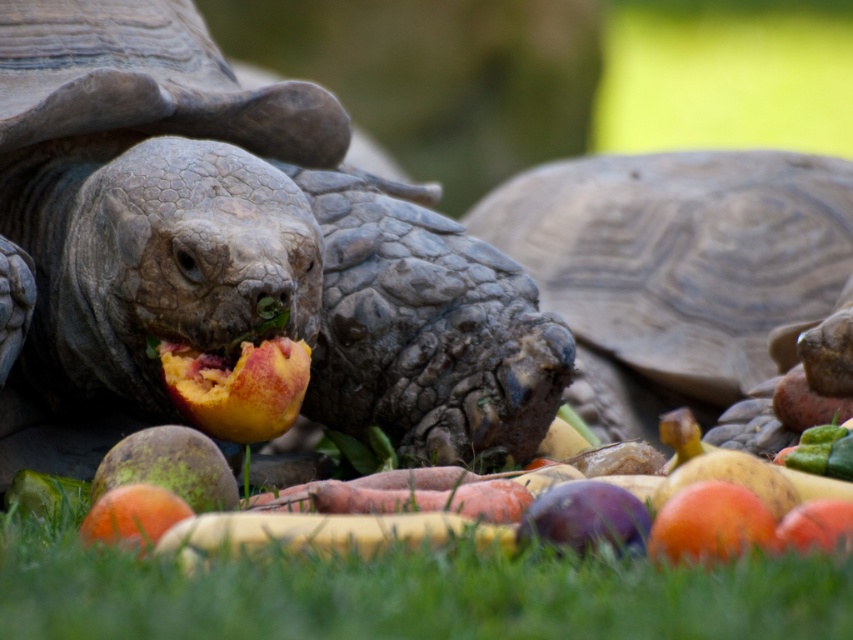
Question: Which of the following is the closest to the observer?

Choices:
 (A) leathery gray tortoise at center
 (B) leathery brown tortoise at center
 (C) smooth orange mango at center

Answer: (C)

Question: Which is farther from the orange matte peach at center?

Choices:
 (A) leathery gray tortoise at center
 (B) green grass at lower center

Answer: (A)

Question: Can you confirm if leathery brown tortoise at center is thinner than green grass at lower center?

Choices:
 (A) yes
 (B) no

Answer: (B)

Question: Is ripe peach at center smaller than smooth orange mango at center?

Choices:
 (A) no
 (B) yes

Answer: (A)

Question: Which point is closer to the camera?

Choices:
 (A) (3, 100)
 (B) (289, 419)

Answer: (B)

Question: Is ripe peach at center wider than smooth orange mango at center?

Choices:
 (A) yes
 (B) no

Answer: (A)